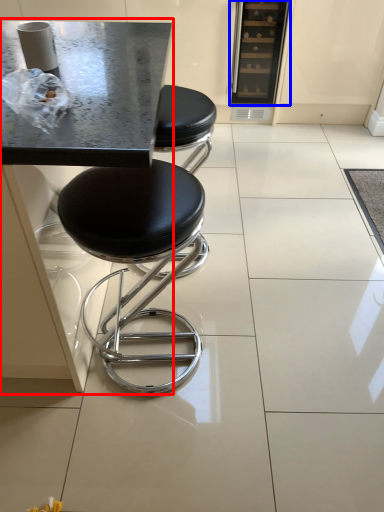
Question: Which of the following is the closest to the observer, round table (highlighted by a red box) or appliance (highlighted by a blue box)?

Choices:
 (A) round table
 (B) appliance

Answer: (A)